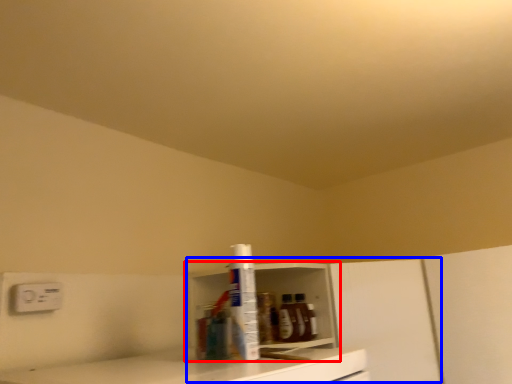
Question: Which object appears closest to the camera in this image, shelf (highlighted by a red box) or cabinetry (highlighted by a blue box)?

Choices:
 (A) shelf
 (B) cabinetry

Answer: (A)